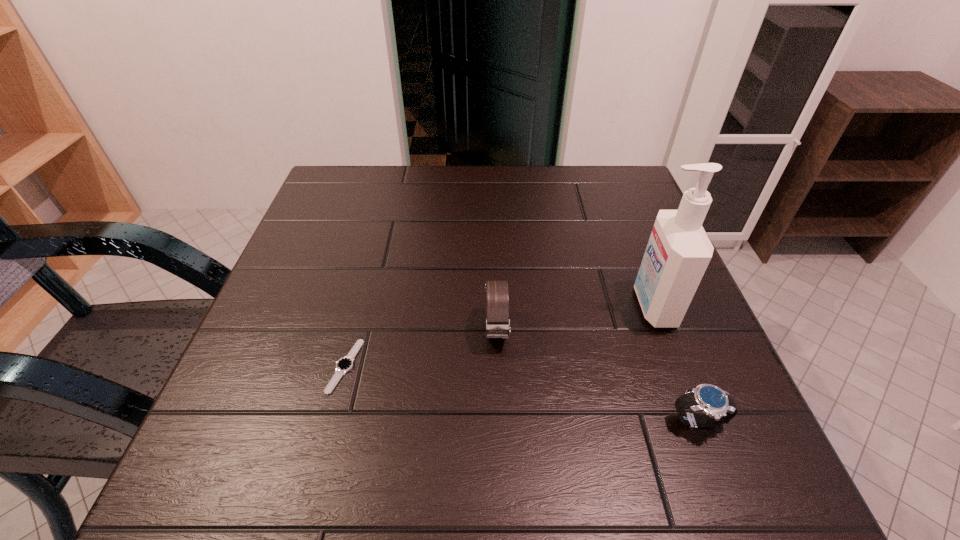
At what (x,y) coordinates should I click in order to perform the action: click on free space located on the face of the second watch from left to right. Please return your answer as a coordinate pair (x, y). Image resolution: width=960 pixels, height=540 pixels. Looking at the image, I should click on (502, 500).

Image resolution: width=960 pixels, height=540 pixels. I want to click on blank space located on the back of the third tallest object, so [636, 259].

This screenshot has height=540, width=960. Find the location of `vacant area located on the left of the leftmost object`. vacant area located on the left of the leftmost object is located at coordinates (297, 366).

You are a GUI agent. You are given a task and a screenshot of the screen. Output one action in this format:
    pyautogui.click(x=<x>, y=<y>)
    Task: Click on the object that is at the near edge
    
    Given the screenshot: What is the action you would take?
    pyautogui.click(x=718, y=406)

Identify the location of cleansing agent present at the right edge. (678, 252).

Where is `watch that is positioned at the right edge`? This screenshot has height=540, width=960. watch that is positioned at the right edge is located at coordinates (718, 406).

This screenshot has height=540, width=960. Find the location of `object positioned at the near right corner`. object positioned at the near right corner is located at coordinates (718, 406).

The width and height of the screenshot is (960, 540). Identify the location of vacant space at the far edge of the desktop. (517, 200).

In order to click on free region at the near edge in this screenshot , I will do `click(648, 476)`.

This screenshot has width=960, height=540. In the image, there is a desktop. What are the coordinates of `vacant space at the left edge` in the screenshot? It's located at (314, 389).